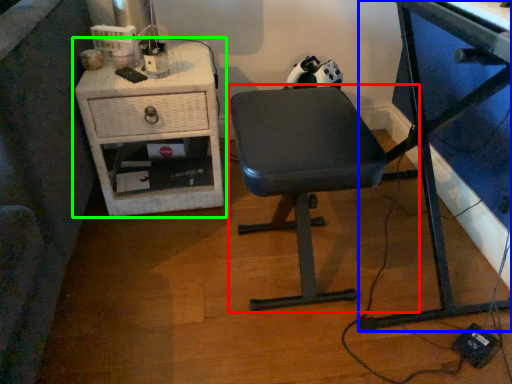
Question: Which is nearer to the chair (highlighted by a red box)? desk (highlighted by a blue box) or nightstand (highlighted by a green box).

Choices:
 (A) desk
 (B) nightstand

Answer: (A)